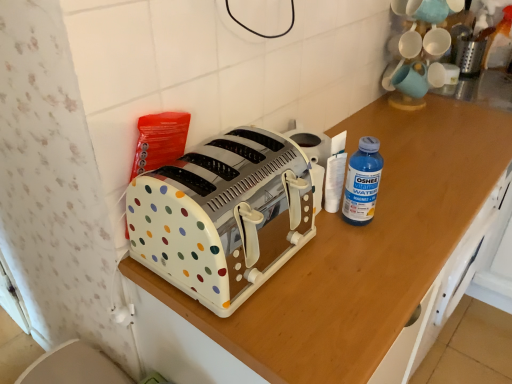
The width and height of the screenshot is (512, 384). What are the coordinates of `free location to the right of blue plastic bottle at right` in the screenshot? It's located at (415, 218).